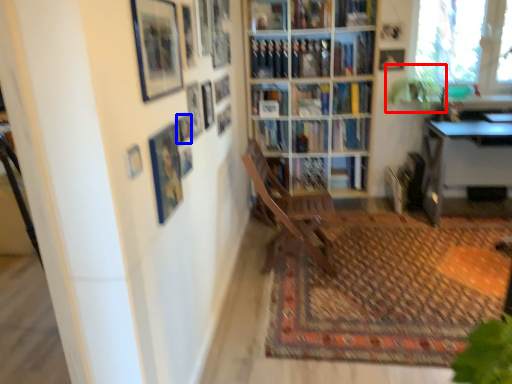
Question: Which object is closer to the camera taking this photo, plant (highlighted by a red box) or picture frame (highlighted by a blue box)?

Choices:
 (A) plant
 (B) picture frame

Answer: (B)